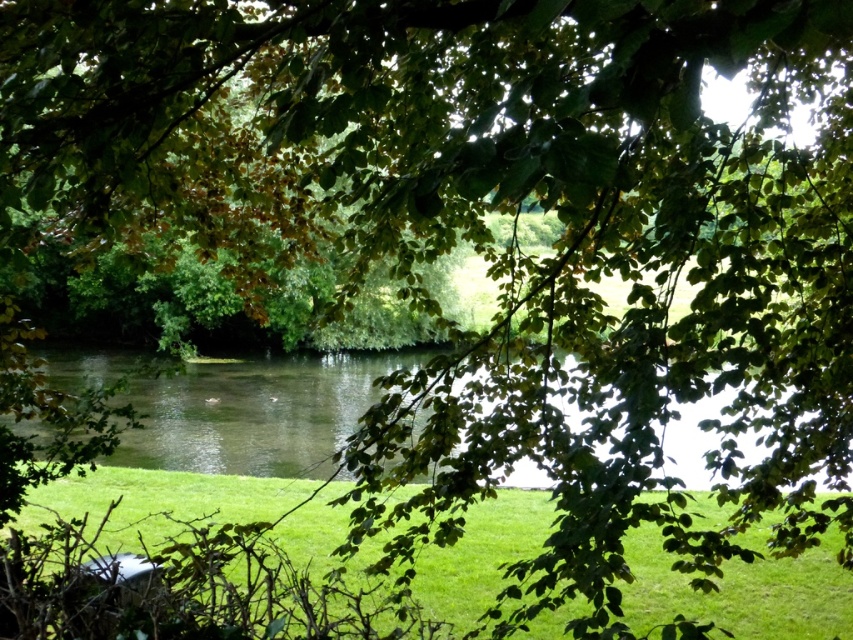
Question: Which point is farther to the camera?

Choices:
 (A) green grassy at lower center
 (B) clear water at center

Answer: (A)

Question: Considering the relative positions of green grassy at lower center and clear water at center in the image provided, where is green grassy at lower center located with respect to clear water at center?

Choices:
 (A) left
 (B) right

Answer: (B)

Question: Which point is closer to the camera?

Choices:
 (A) green grassy at lower center
 (B) clear water at center

Answer: (B)

Question: Can you confirm if green grassy at lower center is positioned to the left of clear water at center?

Choices:
 (A) no
 (B) yes

Answer: (A)

Question: Can you confirm if green grassy at lower center is smaller than clear water at center?

Choices:
 (A) no
 (B) yes

Answer: (B)